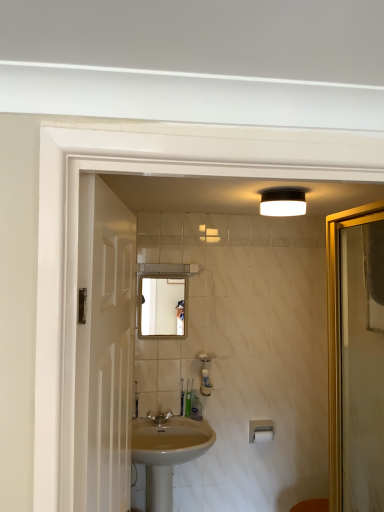
Question: Is white matte light fixture at upper center inside or outside of white matte toilet paper at lower center?

Choices:
 (A) outside
 (B) inside

Answer: (A)

Question: Considering their positions, is white matte light fixture at upper center located in front of or behind white matte toilet paper at lower center?

Choices:
 (A) front
 (B) behind

Answer: (A)

Question: Estimate the real-world distances between objects in this image. Which object is closer to the translucent plastic toothbrush at lower center, positioned as the 2th toiletry in left-to-right order?

Choices:
 (A) matte glass mirror at center
 (B) beige ceramic sink at center
 (C) translucent plastic toothbrush at center, which appears as the third toiletry when viewed from the left
 (D) white glossy screen door at left
 (E) white matte toilet paper at lower center

Answer: (C)

Question: Estimate the real-world distances between objects in this image. Which object is closer to the matte silver faucet at center?

Choices:
 (A) white glossy screen door at left
 (B) green plastic toothbrush at center, the 1th toiletry from the left
 (C) white matte light fixture at upper center
 (D) translucent plastic toothbrush at center, which is the first toiletry in right-to-left order
 (E) beige ceramic sink at center

Answer: (B)